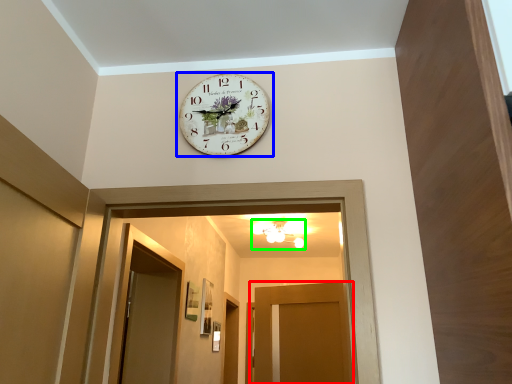
Question: Which object is positioned farthest from door (highlighted by a red box)? Select from wall clock (highlighted by a blue box) and light fixture (highlighted by a green box).

Choices:
 (A) wall clock
 (B) light fixture

Answer: (A)